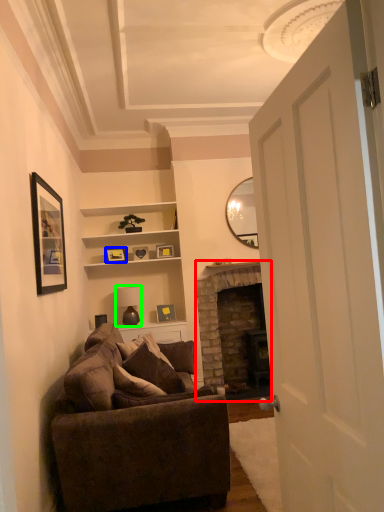
Question: Considering the real-world distances, which object is closest to fireplace (highlighted by a red box)? picture frame (highlighted by a blue box) or lamp (highlighted by a green box).

Choices:
 (A) picture frame
 (B) lamp

Answer: (B)